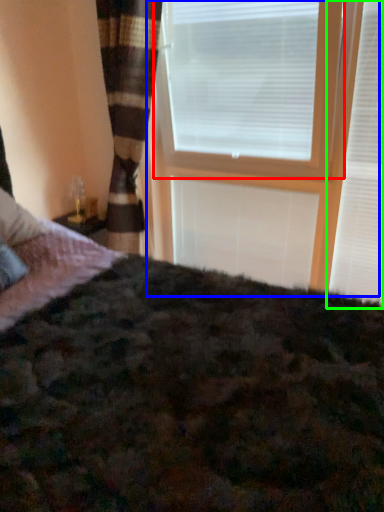
Question: Estimate the real-world distances between objects in this image. Which object is farther from window blind (highlighted by a red box), window frame (highlighted by a blue box) or window blind (highlighted by a green box)?

Choices:
 (A) window frame
 (B) window blind

Answer: (B)